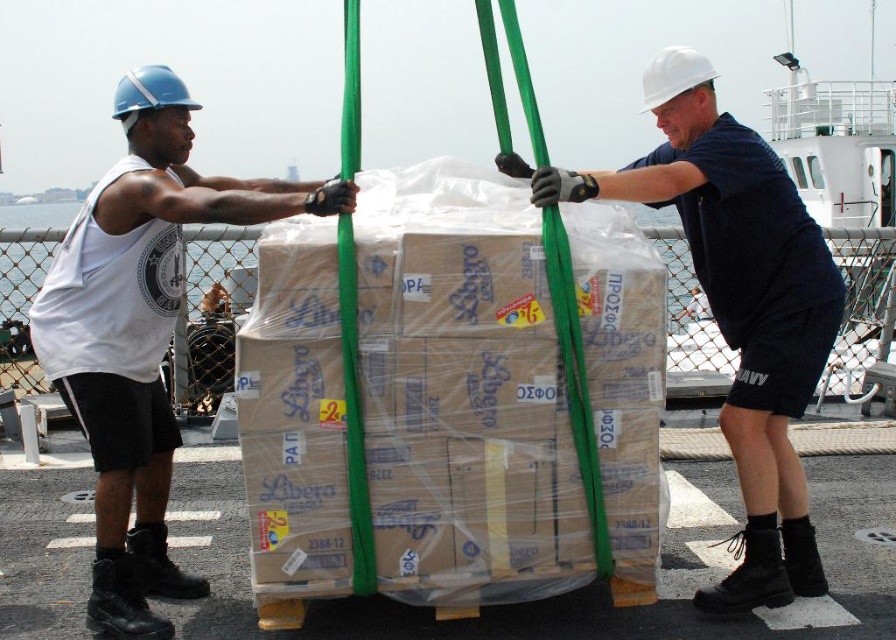
Consider the image. You are a safety inspector observing two workers on a ship deck. You notice both are wearing protective headgear labeled as white matte helmet at upper center and white hard hat at upper center. Based on safety standards, which headgear is more appropriate for this environment?

The white hard hat at upper center is more appropriate because it has a greater height, providing better protection against potential impacts from above compared to the white matte helmet at upper center.

You are a safety inspector on the ship deck. You notice two items labeled in the scene. Which item is lower in height between the white matte tank top at left and the white hard hat at upper center?

The white matte tank top at left has a lesser height compared to the white hard hat at upper center, so the white matte tank top at left is lower in height.